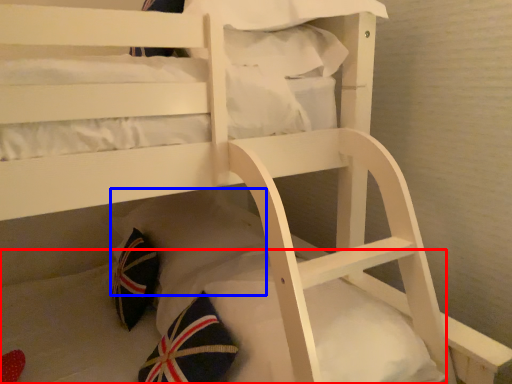
Question: Which of the following is the closest to the observer, mattress (highlighted by a red box) or pillow (highlighted by a blue box)?

Choices:
 (A) mattress
 (B) pillow

Answer: (A)